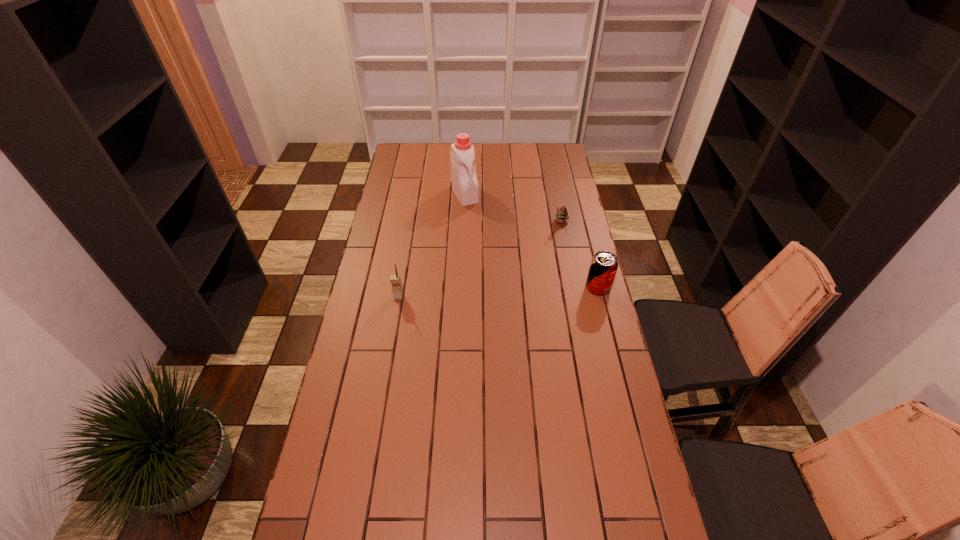
Locate an element on the screen. Image resolution: width=960 pixels, height=540 pixels. unoccupied position between the cellular telephone and the second shortest object is located at coordinates (498, 292).

Find the location of a particular element. The width and height of the screenshot is (960, 540). blank region between the second object from left to right and the second farthest object is located at coordinates (514, 208).

In order to click on vacant region between the shortest object and the leftmost object in this screenshot , I will do `click(480, 260)`.

Locate an element on the screen. This screenshot has height=540, width=960. the third closest object to the third nearest object is located at coordinates (395, 279).

Identify the location of object that stands as the third closest to the leftmost object. The height and width of the screenshot is (540, 960). pyautogui.click(x=562, y=214).

Locate an element on the screen. The width and height of the screenshot is (960, 540). vacant area in the image that satisfies the following two spatial constraints: 1. on the front side of the rightmost object; 2. on the left side of the farthest object is located at coordinates pos(462,287).